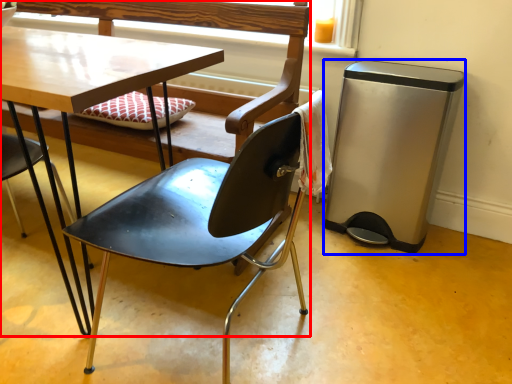
Question: Among these objects, which one is farthest to the camera, chair (highlighted by a red box) or trash bin/can (highlighted by a blue box)?

Choices:
 (A) chair
 (B) trash bin/can

Answer: (B)